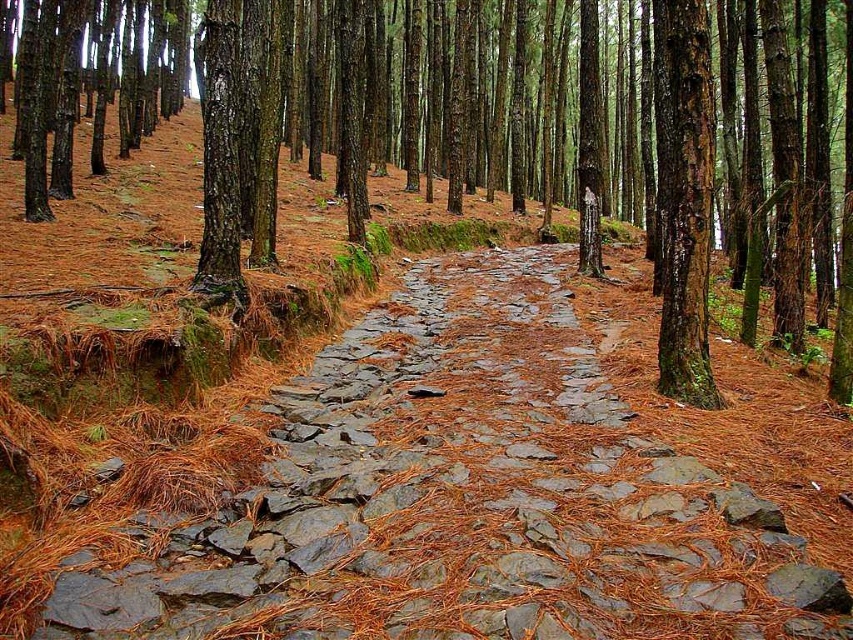
Question: Considering the real-world distances, which object is farthest from the brown rough bark tree at center?

Choices:
 (A) brown bark tree at center
 (B) gray stone path at center

Answer: (A)

Question: Which point is farther to the camera?

Choices:
 (A) (521, 420)
 (B) (682, 326)
 (C) (663, 284)

Answer: (C)

Question: Does gray stone path at center appear on the right side of brown bark tree at center?

Choices:
 (A) no
 (B) yes

Answer: (B)

Question: Is gray stone path at center to the left of brown bark tree at center from the viewer's perspective?

Choices:
 (A) no
 (B) yes

Answer: (A)

Question: Which of the following is the closest to the observer?

Choices:
 (A) (268, 502)
 (B) (756, 13)

Answer: (A)

Question: Observing the image, what is the correct spatial positioning of brown bark tree at center in reference to brown rough bark tree at center?

Choices:
 (A) right
 (B) left

Answer: (B)